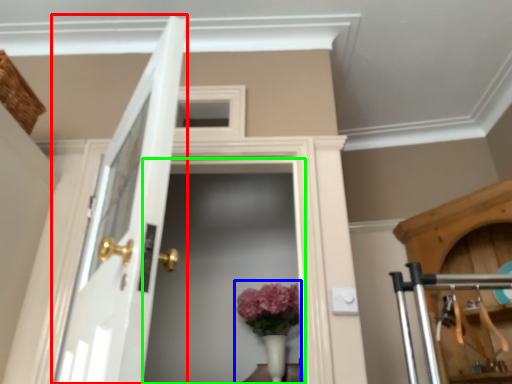
Question: Which object is the farthest from door (highlighted by a red box)? Choose among these: floral arrangement (highlighted by a blue box) or screen door (highlighted by a green box).

Choices:
 (A) floral arrangement
 (B) screen door

Answer: (B)